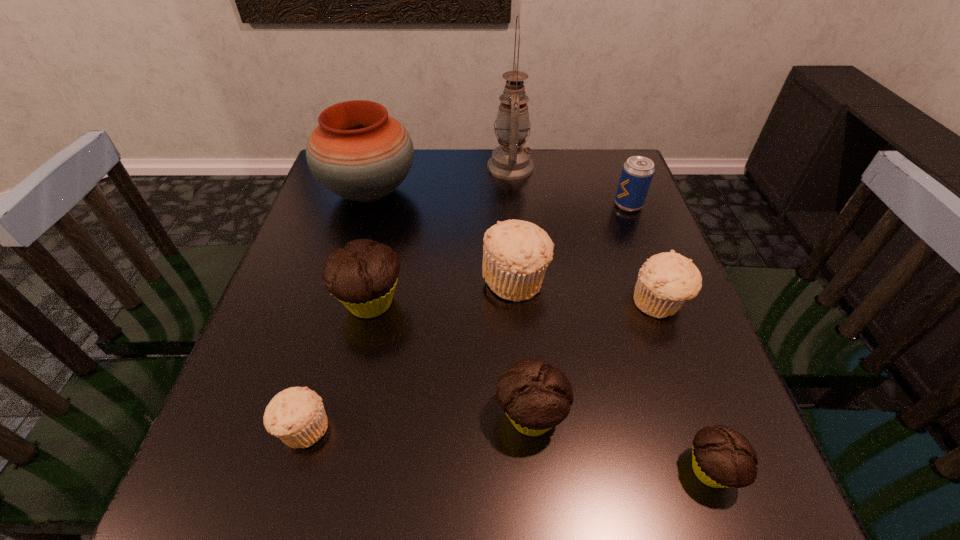
Choose which chocolate muffin is the third nearest neighbor to the second biggest beige muffin. Please provide its 2D coordinates. Your answer should be formatted as a tuple, i.e. [(x, y)], where the tuple contains the x and y coordinates of a point satisfying the conditions above.

[(363, 275)]

Identify which chocolate muffin is located as the third nearest to the pottery. Please provide its 2D coordinates. Your answer should be formatted as a tuple, i.e. [(x, y)], where the tuple contains the x and y coordinates of a point satisfying the conditions above.

[(721, 457)]